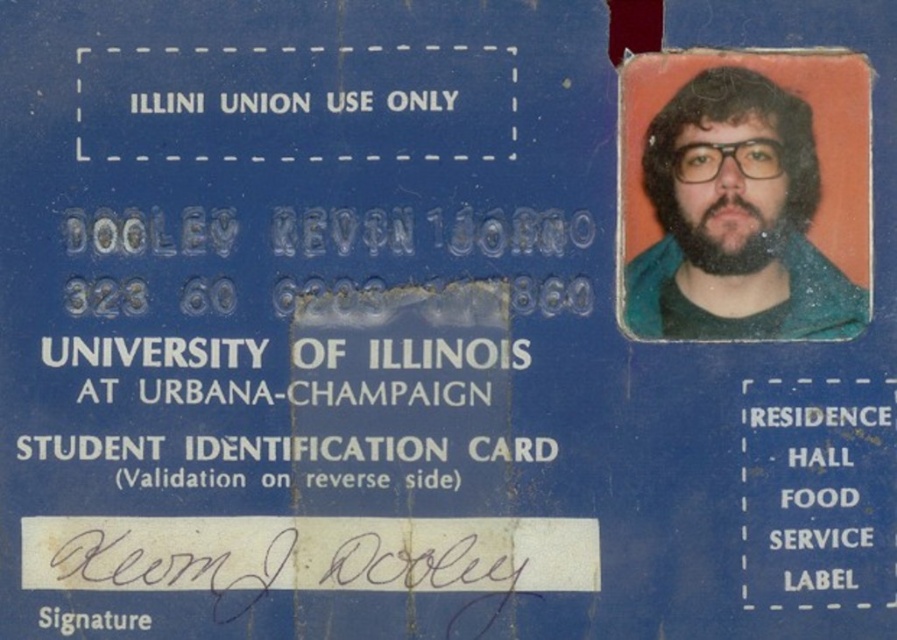
You are examining a student ID card and notice the green matte jacket at upper right and the dark brown thick beard at upper right. Which of these two items appears closer to you on the card?

The green matte jacket at upper right appears closer to you than the dark brown thick beard at upper right.

You are a security guard checking the student ID card. You notice the green matte jacket at upper right and the dark brown thick beard at upper right. Which object is covering part of the other?

The green matte jacket at upper right is positioned over the dark brown thick beard at upper right, so the jacket is covering part of the beard.